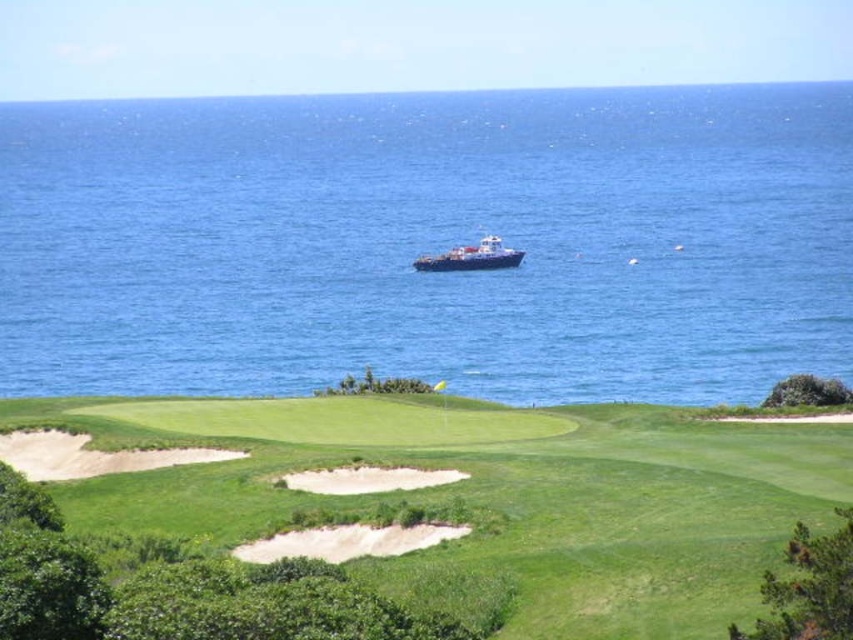
Question: Which point is closer to the camera taking this photo?

Choices:
 (A) (148, 481)
 (B) (485, 240)
 (C) (403, 484)

Answer: (C)

Question: Can you confirm if blue water at center is smaller than white sand bunker at center?

Choices:
 (A) no
 (B) yes

Answer: (A)

Question: Can you confirm if green grassy golf course at lower center is smaller than white sand bunker at center?

Choices:
 (A) no
 (B) yes

Answer: (A)

Question: Which point is closer to the camera?

Choices:
 (A) green grassy golf course at lower center
 (B) white sand bunker at center

Answer: (A)

Question: Is blue water at center below green grassy golf course at lower center?

Choices:
 (A) yes
 (B) no

Answer: (B)

Question: Which object is positioned farthest from the blue metallic ship at center?

Choices:
 (A) green grassy golf course at lower center
 (B) blue water at center
 (C) white sand bunker at center

Answer: (C)